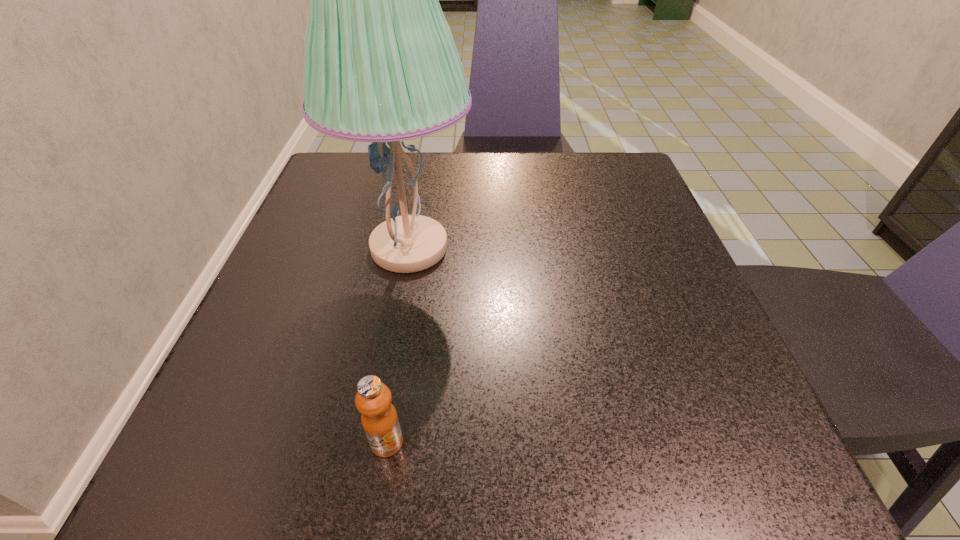
The width and height of the screenshot is (960, 540). What are the coordinates of `the taller object` in the screenshot? It's located at (381, 65).

Image resolution: width=960 pixels, height=540 pixels. Find the location of `lamp`. lamp is located at coordinates coord(381,65).

Identify the location of the nearer object. The image size is (960, 540). (379, 418).

At what (x,y) coordinates should I click in order to perform the action: click on the shorter object. Please return your answer as a coordinate pair (x, y). Looking at the image, I should click on (379, 418).

Identify the location of vacant space located on the back of the farther object. The width and height of the screenshot is (960, 540). (423, 171).

Find the location of a particular element. This screenshot has height=540, width=960. object that is at the near edge is located at coordinates (379, 418).

Locate an element on the screen. The width and height of the screenshot is (960, 540). object located in the left edge section of the desktop is located at coordinates (381, 65).

In the image, there is a desktop. Where is `vacant region at the far edge`? vacant region at the far edge is located at coordinates (491, 154).

Image resolution: width=960 pixels, height=540 pixels. I want to click on vacant space at the near edge of the desktop, so click(521, 465).

You are a GUI agent. You are given a task and a screenshot of the screen. Output one action in this format:
    pyautogui.click(x=<x>, y=<y>)
    Task: Click on the vacant space at the left edge
    This screenshot has width=960, height=540.
    Given the screenshot: What is the action you would take?
    pyautogui.click(x=269, y=354)